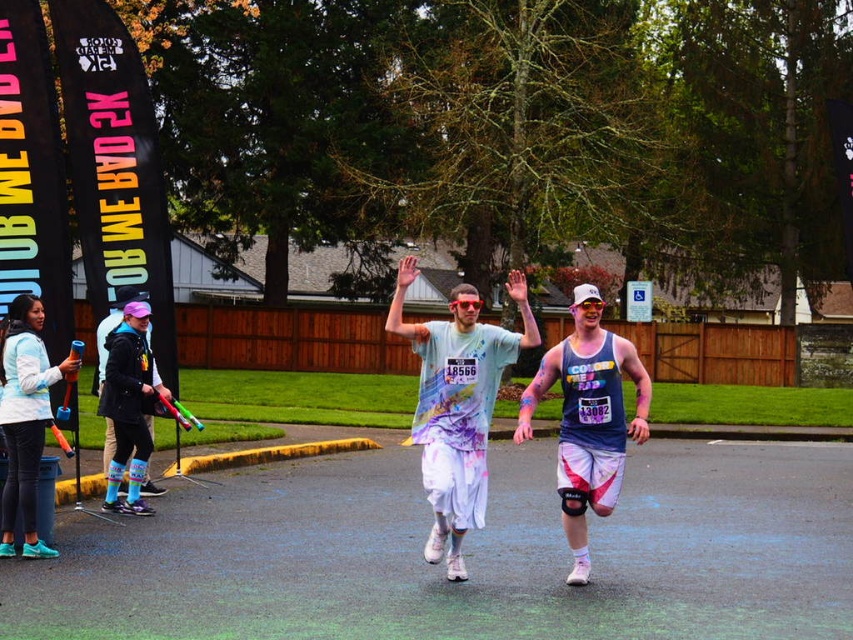
Can you confirm if matte tie-dye shirt at center is bigger than matte blue tank top at center?

No, matte tie-dye shirt at center is not bigger than matte blue tank top at center.

Who is lower down, matte tie-dye shirt at center or matte blue tank top at center?

matte tie-dye shirt at center is below.

Describe the element at coordinates (457, 404) in the screenshot. I see `matte tie-dye shirt at center` at that location.

Locate an element on the screen. matte tie-dye shirt at center is located at coordinates point(457,404).

Is point (608, 368) behind point (22, 317)?

No, (608, 368) is closer to viewer.

Can you confirm if matte blue tank top at center is wider than matte blue jacket at lower left?

No.

Where is `matte blue tank top at center`? matte blue tank top at center is located at coordinates (589, 419).

At what (x,y) coordinates should I click in order to perform the action: click on matte blue tank top at center. Please return your answer as a coordinate pair (x, y). Looking at the image, I should click on (589, 419).

Is point (538, 340) closer to camera compared to point (13, 392)?

Yes, point (538, 340) is in front of point (13, 392).

I want to click on matte tie-dye shirt at center, so click(457, 404).

The image size is (853, 640). Describe the element at coordinates (457, 404) in the screenshot. I see `matte tie-dye shirt at center` at that location.

Locate an element on the screen. The width and height of the screenshot is (853, 640). matte tie-dye shirt at center is located at coordinates (457, 404).